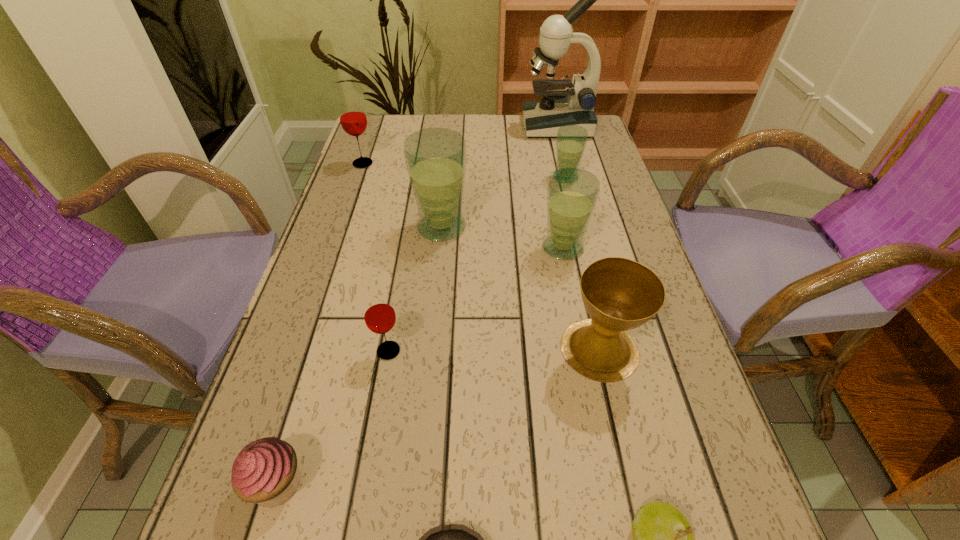
Locate an element on the screen. The height and width of the screenshot is (540, 960). the smaller red glass is located at coordinates (379, 314).

Identify the location of pink cupcake. (266, 472).

I want to click on vacant space located 0.110m at the eyepiece of the microscope, so click(x=489, y=126).

I want to click on vacant space located at the eyepiece of the microscope, so click(x=476, y=126).

Where is `free space located 0.230m at the eyepiece of the microscope`? The width and height of the screenshot is (960, 540). free space located 0.230m at the eyepiece of the microscope is located at coordinates (451, 126).

This screenshot has width=960, height=540. I want to click on vacant position located 0.080m on the front of the leftmost blue glass, so click(x=437, y=271).

Find the location of `free space located on the back of the farther red glass`. free space located on the back of the farther red glass is located at coordinates (377, 121).

In order to click on vacant space located on the back of the second biggest blue glass in this screenshot , I will do `click(551, 187)`.

Where is `vacant space located on the left of the brown chalice`? The width and height of the screenshot is (960, 540). vacant space located on the left of the brown chalice is located at coordinates (523, 349).

Locate an element on the screen. Image resolution: width=960 pixels, height=540 pixels. vacant space located on the left of the smallest blue glass is located at coordinates (511, 177).